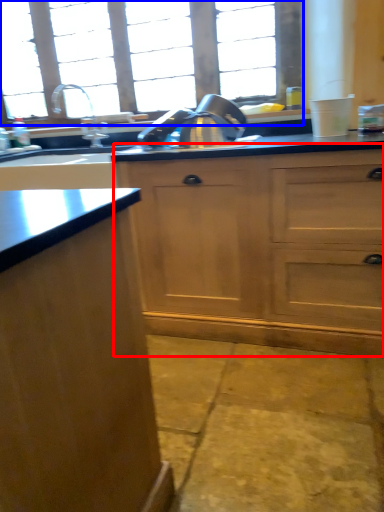
Question: Which point is closer to the camera, dresser (highlighted by a red box) or window (highlighted by a blue box)?

Choices:
 (A) dresser
 (B) window

Answer: (A)